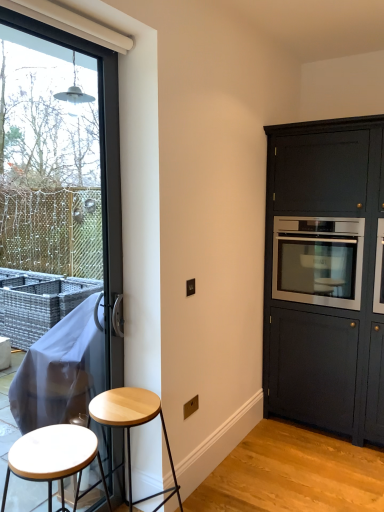
Identify the location of empty space that is ontop of light wood stool at lower left, which is counted as the 2th stool, starting from the front. (125, 403).